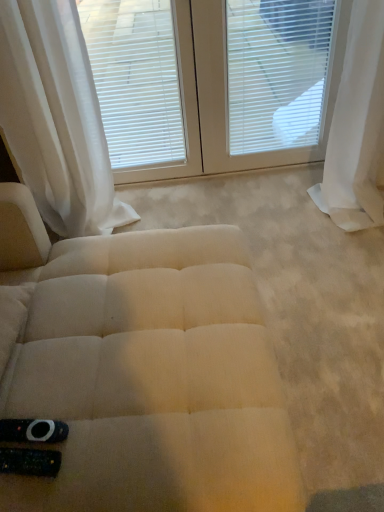
At what (x,y) coordinates should I click in order to perform the action: click on free spot to the right of white matte window blind at upper center. Please return your answer as a coordinate pair (x, y). Looking at the image, I should click on (218, 195).